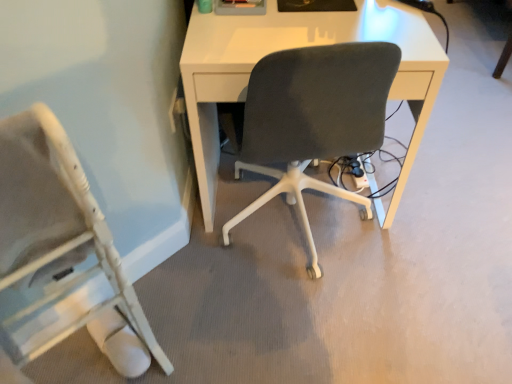
Question: In the image, is white matte desk at center positioned in front of or behind white wood chair at lower left?

Choices:
 (A) behind
 (B) front

Answer: (A)

Question: From the image's perspective, is white matte desk at center above or below white wood chair at lower left?

Choices:
 (A) above
 (B) below

Answer: (A)

Question: Looking at the image, does white matte desk at center seem bigger or smaller compared to white wood chair at lower left?

Choices:
 (A) small
 (B) big

Answer: (B)

Question: Does point (28, 152) appear closer or farther from the camera than point (216, 21)?

Choices:
 (A) farther
 (B) closer

Answer: (B)

Question: From the image's perspective, is white wood chair at lower left positioned above or below white matte desk at center?

Choices:
 (A) below
 (B) above

Answer: (A)

Question: Is white wood chair at lower left taller or shorter than white matte desk at center?

Choices:
 (A) tall
 (B) short

Answer: (A)

Question: From a real-world perspective, is white wood chair at lower left physically located above or below white matte desk at center?

Choices:
 (A) above
 (B) below

Answer: (A)